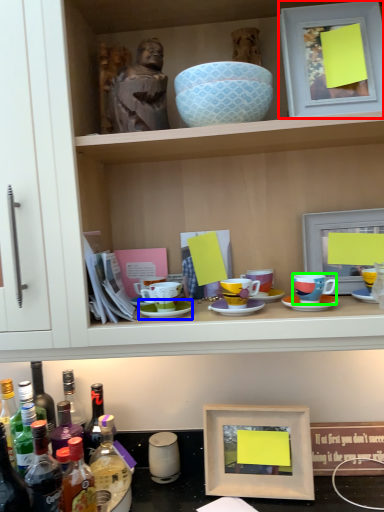
Question: Which object is the farthest from picture frame (highlighted by a red box)? Choose among these: saucer (highlighted by a blue box) or coffee cup (highlighted by a green box).

Choices:
 (A) saucer
 (B) coffee cup

Answer: (A)